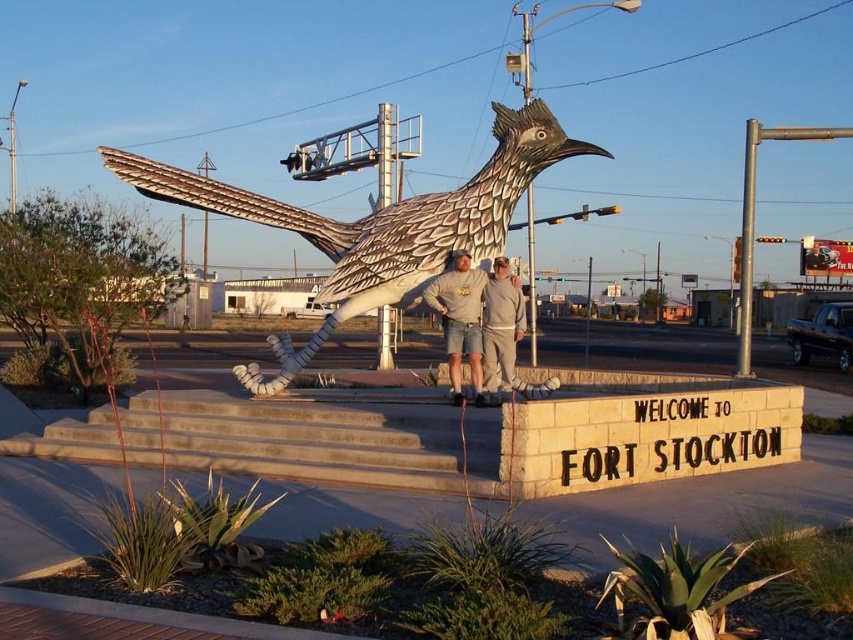
You are a tourist visiting Fort Stockton and see the white painted wood roadrunner at center and the gray fleece sweatshirt at center in the image. Which object is positioned more to the left side of the scene?

The white painted wood roadrunner at center is positioned more to the left side of the scene than the gray fleece sweatshirt at center.

You are a tourist standing at the base of the roadrunner sculpture in Fort Stockton. You notice a point marked at coordinates [376,225] on the sculpture. Where exactly is this point located on the roadrunner statue?

The point marked at coordinates [376,225] is located on the white painted wood roadrunner at center.